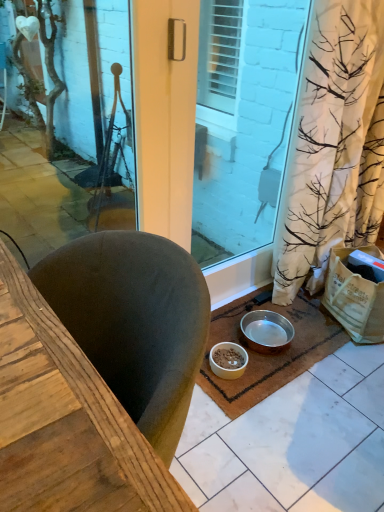
Question: Looking at the image, does metallic silver bowl at lower center, placed as the first bowl when sorted from right to left, seem bigger or smaller compared to transparent glass screen door at center?

Choices:
 (A) big
 (B) small

Answer: (B)

Question: From a real-world perspective, relative to transparent glass screen door at center, is metallic silver bowl at lower center, placed as the first bowl when sorted from right to left, vertically above or below?

Choices:
 (A) above
 (B) below

Answer: (B)

Question: Which object is positioned farthest from the transparent glass screen door at center?

Choices:
 (A) brown coir mat at lower center
 (B) white matte bowl at lower center, arranged as the 2th bowl when viewed from the right
 (C) metallic silver bowl at lower center, placed as the first bowl when sorted from right to left

Answer: (B)

Question: Estimate the real-world distances between objects in this image. Which object is closer to the brown coir mat at lower center?

Choices:
 (A) white matte bowl at lower center, the first bowl when ordered from left to right
 (B) metallic silver bowl at lower center, which appears as the 2th bowl when viewed from the left
 (C) transparent glass screen door at center

Answer: (B)